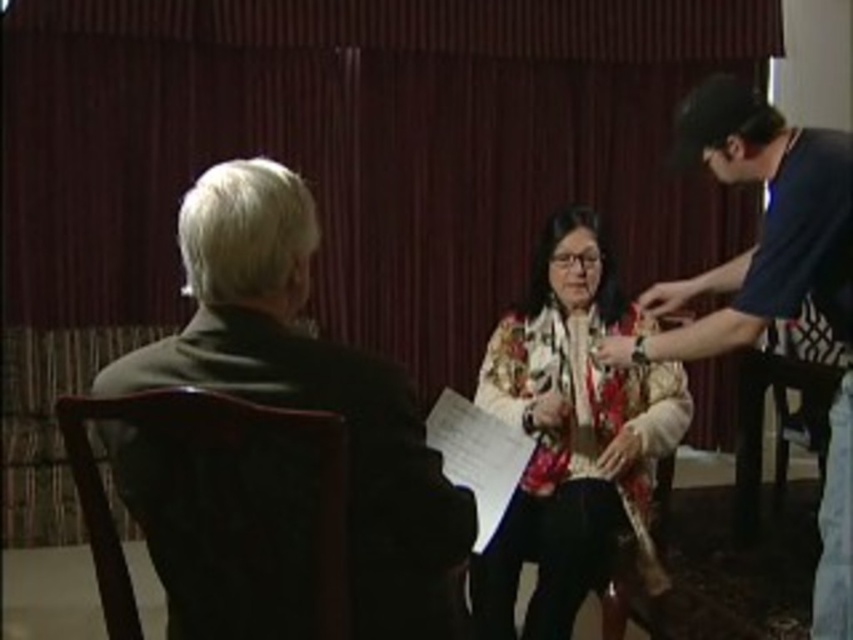
Question: Is dark brown leather jacket at left bigger than wooden chair at lower right?

Choices:
 (A) yes
 (B) no

Answer: (B)

Question: Among these points, which one is nearest to the camera?

Choices:
 (A) (120, 588)
 (B) (810, 384)

Answer: (A)

Question: Observing the image, what is the correct spatial positioning of blue cotton t-shirt at right in reference to wooden chair at lower right?

Choices:
 (A) left
 (B) right

Answer: (A)

Question: Which object is positioned closest to the wooden chair at lower right?

Choices:
 (A) dark brown leather jacket at left
 (B) floral-patterned blouse at center
 (C) blue cotton t-shirt at right

Answer: (C)

Question: Can you confirm if dark brown leather jacket at left is bigger than wooden chair at left?

Choices:
 (A) yes
 (B) no

Answer: (A)

Question: Which point is closer to the camera?

Choices:
 (A) (735, 433)
 (B) (750, 266)
 (C) (177, 404)
 (D) (276, 324)

Answer: (C)